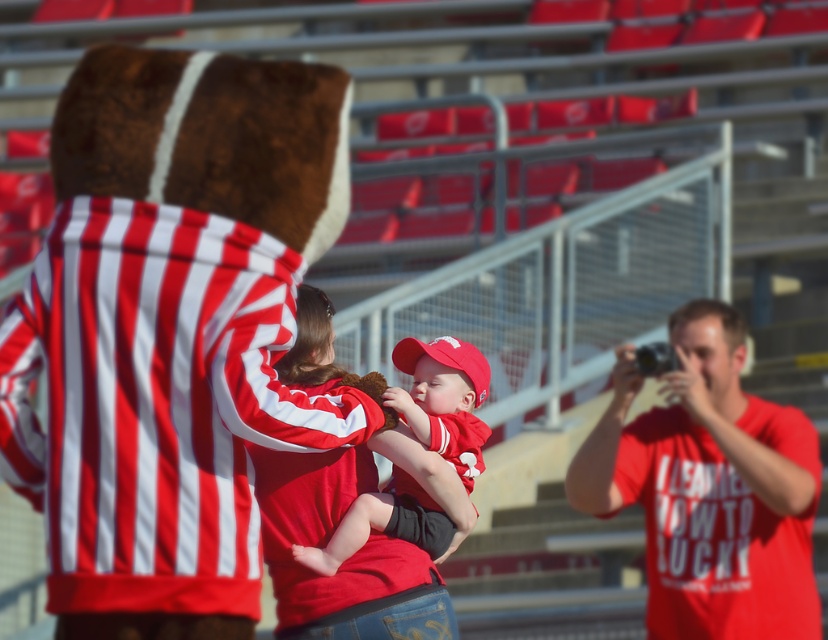
Measure the distance between matte red t-shirt at right and matte red cap at center.

matte red t-shirt at right is 1.45 meters from matte red cap at center.

Who is shorter, matte red t-shirt at right or matte red cap at center?

With less height is matte red cap at center.

Describe the element at coordinates (710, 488) in the screenshot. I see `matte red t-shirt at right` at that location.

Find the location of a particular element. matte red t-shirt at right is located at coordinates (710, 488).